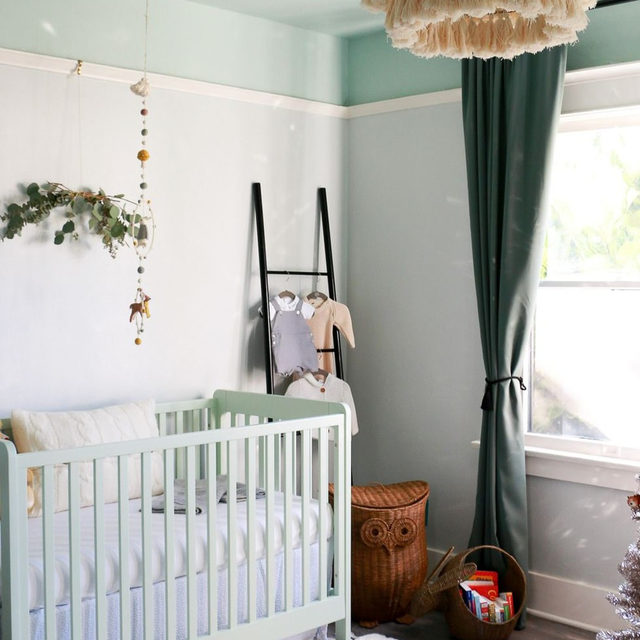
The height and width of the screenshot is (640, 640). What are the coordinates of `crib` in the screenshot? It's located at (205, 502).